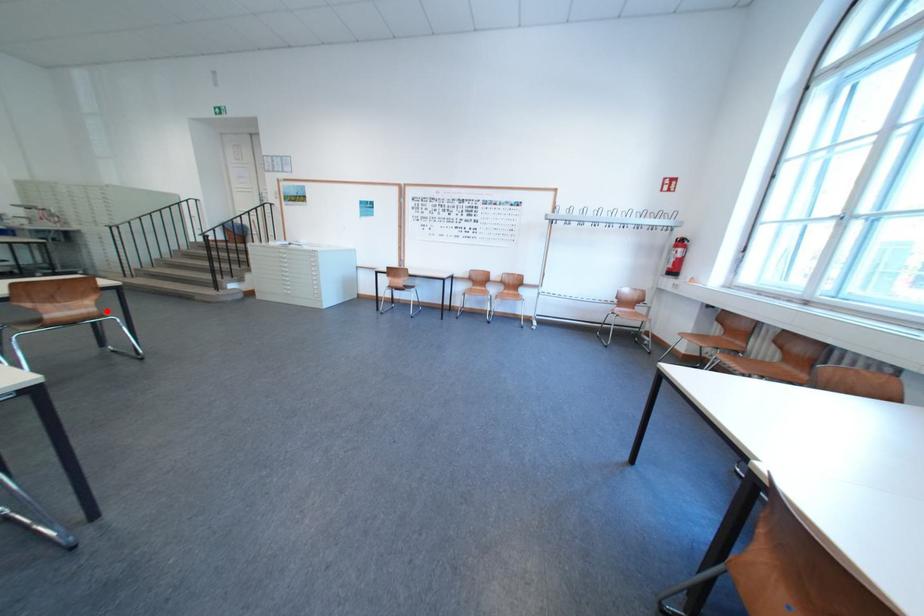
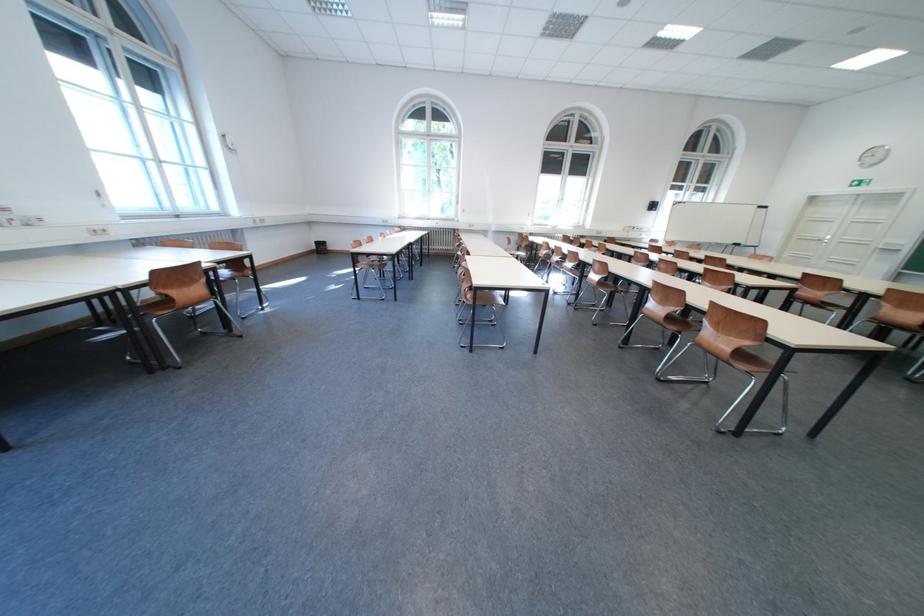
Locate, in the second image, the point that corresponds to the highlighted location in the first image.

(744, 352)